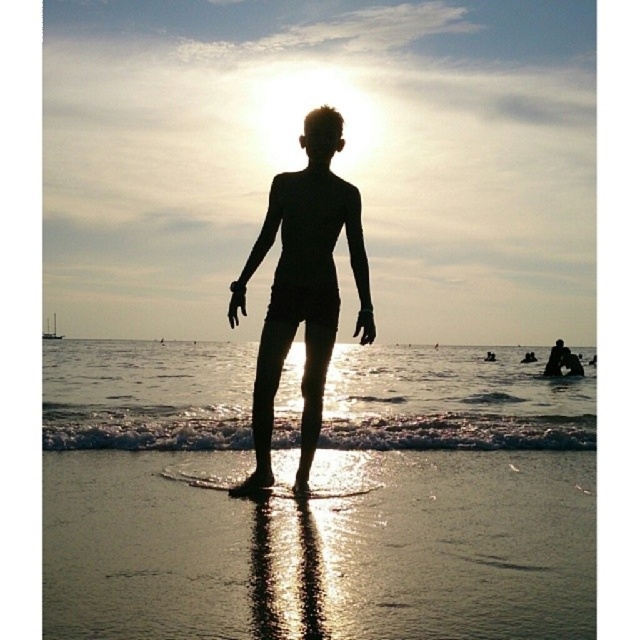
What are the coordinates of the black matte figure at center?

The black matte figure at center is located at coordinates (304,285).

You are a photographer trying to capture the black matte figure at center and the translucent wet sand at lower center in a single shot. Which object will appear closer to the camera in the photo?

The translucent wet sand at lower center will appear closer to the camera because it is further to the viewer than the black matte figure at center, meaning it is positioned nearer in the scene.

You are a photographer trying to capture the reflection of the sunset on the beach. You notice two areas of sand at the lower center of the image. Which one, the shiny sand at lower center or the translucent wet sand at lower center, is closer to the waterline?

The translucent wet sand at lower center is taller than shiny sand at lower center, meaning it is closer to the waterline since higher elevation typically indicates proximity to the shoreline in such beach scenes.